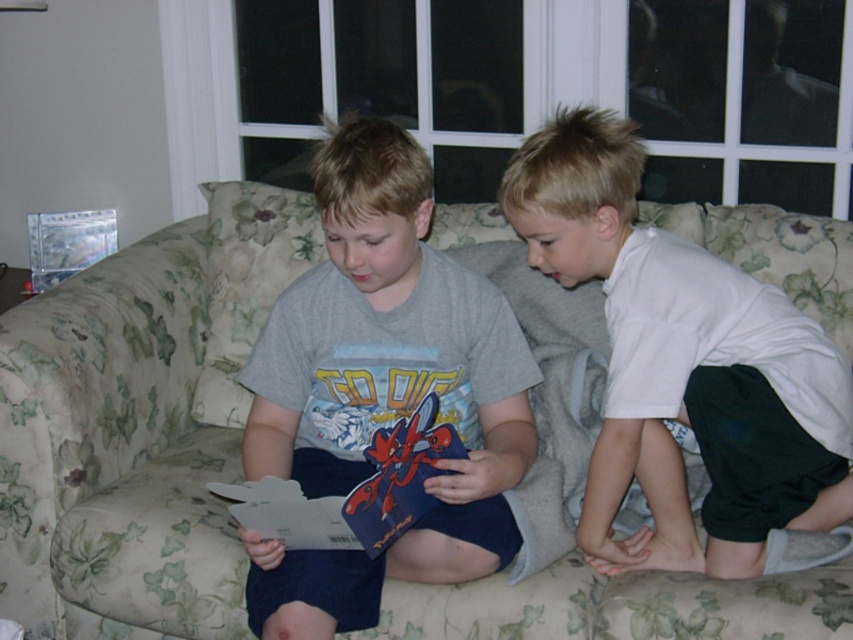
You are a photographer trying to capture both the gray cotton shirt at center and the white cotton shirt at right in a single frame. Since the shirts are different in size, which one should you focus on to ensure they both fit well in the photo?

The gray cotton shirt at center is bigger than the white cotton shirt at right, so you should focus on including the larger gray cotton shirt at center first to ensure both fit well in the photo.

You are a photographer taking a picture of the two boys sitting on the couch. You want to ensure both the gray cotton shirt at center and the white cotton shirt at right are clearly visible in the photo. Based on their positions, which shirt is more likely to be fully visible in the photo?

The gray cotton shirt at center is more likely to be fully visible because it is in front of the white cotton shirt at right.